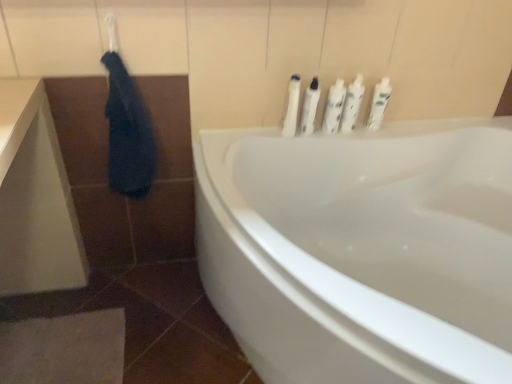
The image size is (512, 384). Find the location of `vacant space positioned to the left of white glossy bottles at upper center, arranged as the second toiletry when viewed from the left`. vacant space positioned to the left of white glossy bottles at upper center, arranged as the second toiletry when viewed from the left is located at coordinates (265, 137).